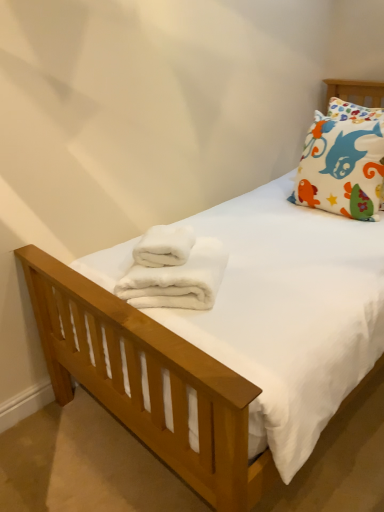
Question: In the image, is white cotton pillow at upper right positioned in front of or behind white fluffy bath towel at center, which appears as the 2th bath towel when ordered from the bottom?

Choices:
 (A) front
 (B) behind

Answer: (B)

Question: Is white cotton pillow at upper right taller or shorter than white fluffy bath towel at center, which appears as the 2th bath towel when ordered from the bottom?

Choices:
 (A) short
 (B) tall

Answer: (B)

Question: Which is nearer to the white fluffy bath towel at center, which appears as the 2th bath towel when ordered from the bottom?

Choices:
 (A) white cotton pillow at upper right
 (B) white fluffy bath towel at center, the second bath towel in the top-to-bottom sequence

Answer: (B)

Question: Which object is the farthest from the white cotton pillow at upper right?

Choices:
 (A) white fluffy bath towel at center, the 1th bath towel positioned from the bottom
 (B) white fluffy bath towel at center, the first bath towel when ordered from top to bottom

Answer: (A)